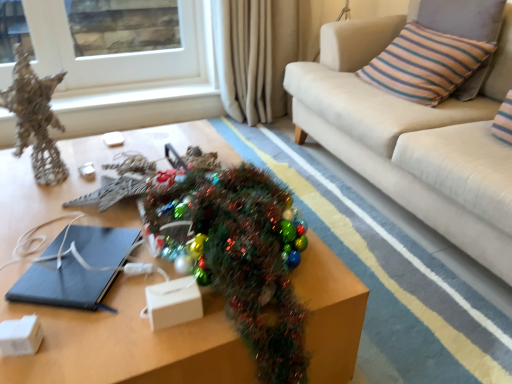
Locate an element on the screen. The image size is (512, 384). vacant point above metallic brown table at center (from a real-world perspective) is located at coordinates [88, 215].